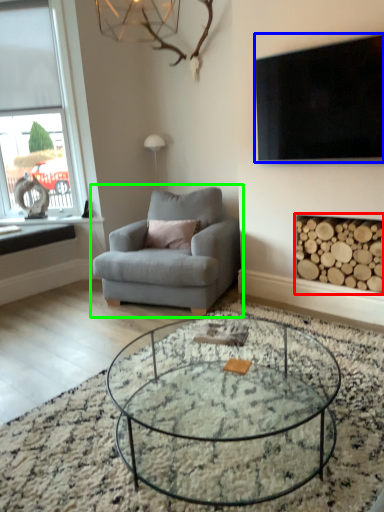
Question: Estimate the real-world distances between objects in this image. Which object is closer to fireplace (highlighted by a red box), television (highlighted by a blue box) or chair (highlighted by a green box)?

Choices:
 (A) television
 (B) chair

Answer: (A)